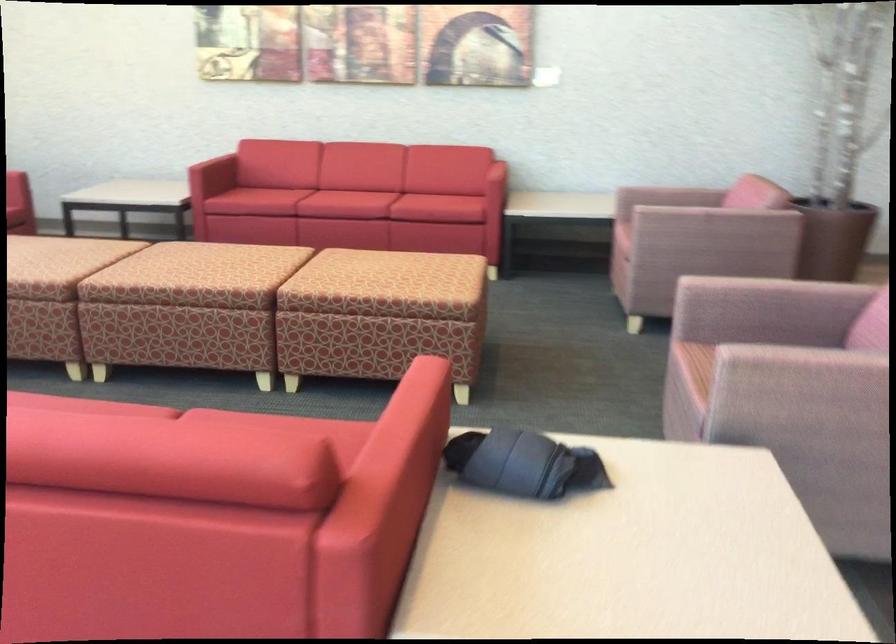
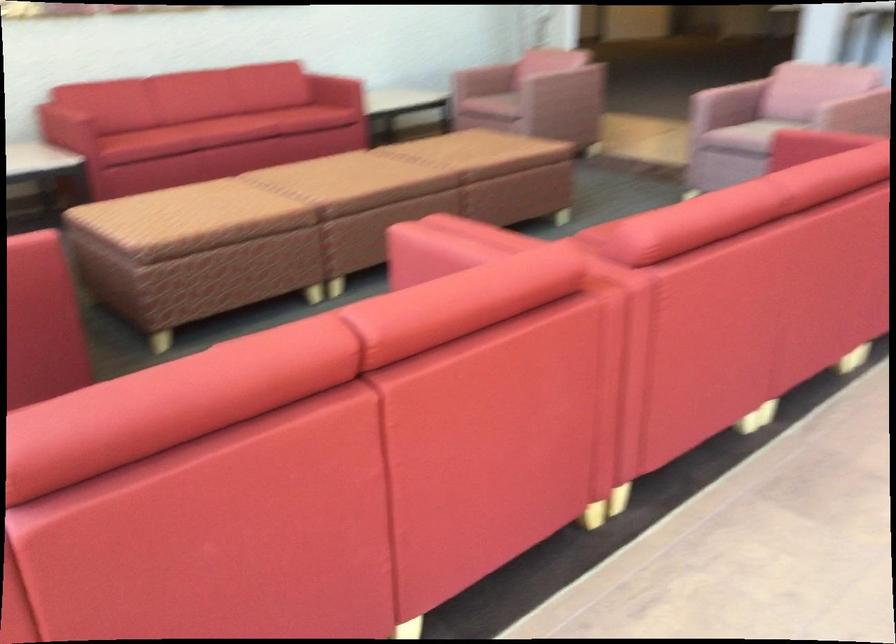
The point at (186, 263) is marked in the first image. Where is the corresponding point in the second image?

(349, 184)